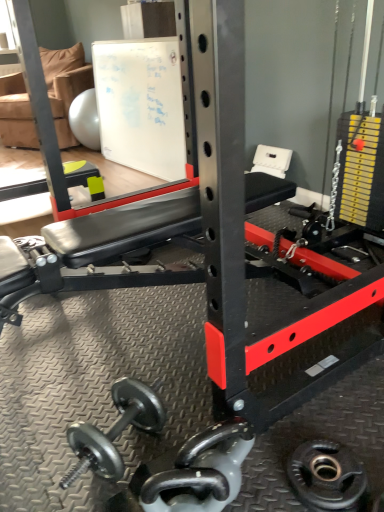
Question: Can you confirm if polished silver dumbbell at center is wider than tan fabric chair at upper left?

Choices:
 (A) yes
 (B) no

Answer: (B)

Question: From the image's perspective, would you say polished silver dumbbell at center is shown under tan fabric chair at upper left?

Choices:
 (A) no
 (B) yes

Answer: (B)

Question: From a real-world perspective, is polished silver dumbbell at center located beneath tan fabric chair at upper left?

Choices:
 (A) no
 (B) yes

Answer: (B)

Question: Can you confirm if polished silver dumbbell at center is shorter than tan fabric chair at upper left?

Choices:
 (A) no
 (B) yes

Answer: (B)

Question: Is tan fabric chair at upper left located within polished silver dumbbell at center?

Choices:
 (A) no
 (B) yes

Answer: (A)

Question: From a real-world perspective, is white matte board at upper center physically located above or below polished silver dumbbell at center?

Choices:
 (A) above
 (B) below

Answer: (A)

Question: Would you say white matte board at upper center is to the left or to the right of polished silver dumbbell at center in the picture?

Choices:
 (A) right
 (B) left

Answer: (B)

Question: Is white matte board at upper center situated inside polished silver dumbbell at center or outside?

Choices:
 (A) outside
 (B) inside

Answer: (A)

Question: Is point (x=168, y=133) closer or farther from the camera than point (x=231, y=433)?

Choices:
 (A) closer
 (B) farther

Answer: (B)

Question: Is black rubber weight plate at lower right in front of or behind polished silver dumbbell at center in the image?

Choices:
 (A) front
 (B) behind

Answer: (B)

Question: From their relative heights in the image, would you say black rubber weight plate at lower right is taller or shorter than polished silver dumbbell at center?

Choices:
 (A) short
 (B) tall

Answer: (A)

Question: Is black rubber weight plate at lower right to the left or to the right of polished silver dumbbell at center in the image?

Choices:
 (A) right
 (B) left

Answer: (A)

Question: Considering the positions of point (327, 487) and point (225, 428), is point (327, 487) closer or farther from the camera than point (225, 428)?

Choices:
 (A) farther
 (B) closer

Answer: (A)

Question: Looking at the image, does tan fabric chair at upper left seem bigger or smaller compared to black rubber weight plate at lower right?

Choices:
 (A) big
 (B) small

Answer: (A)

Question: Is point (46, 62) positioned closer to the camera than point (324, 488)?

Choices:
 (A) farther
 (B) closer

Answer: (A)